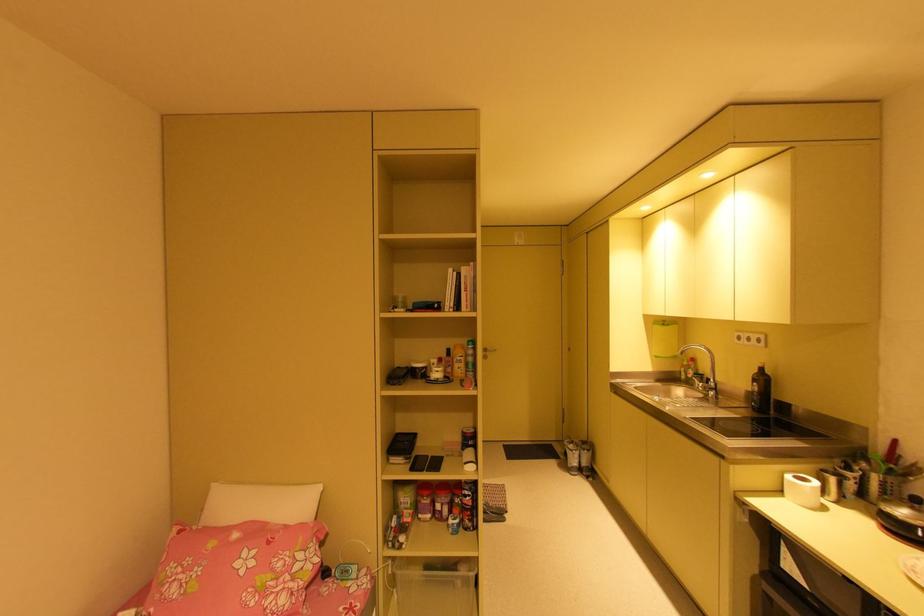
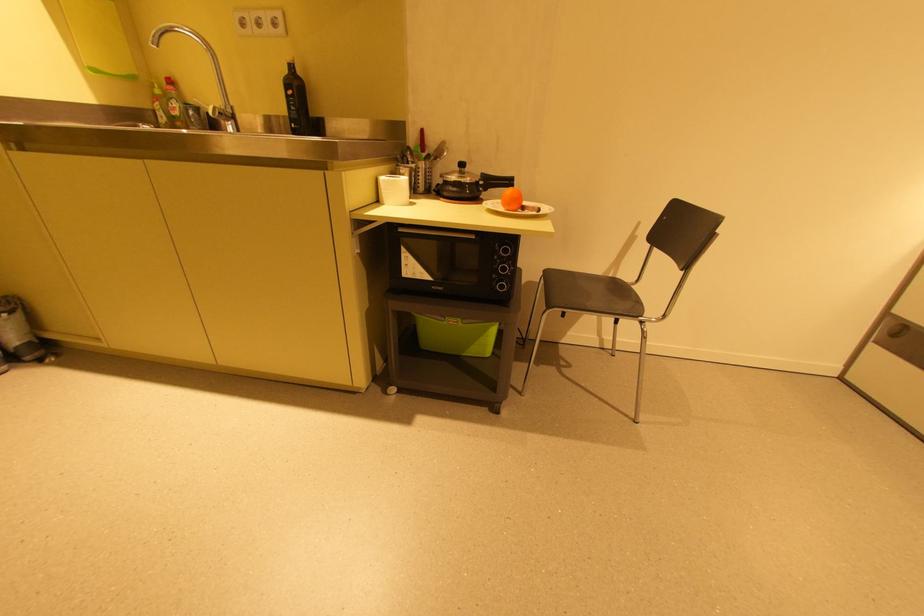
Where in the second image is the point corresponding to [760,371] from the first image?

(289, 71)